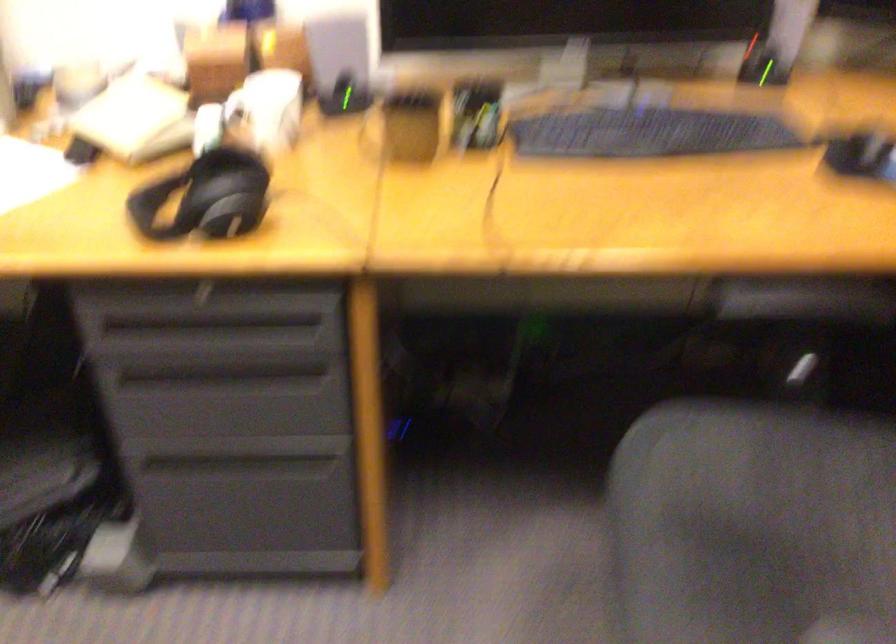
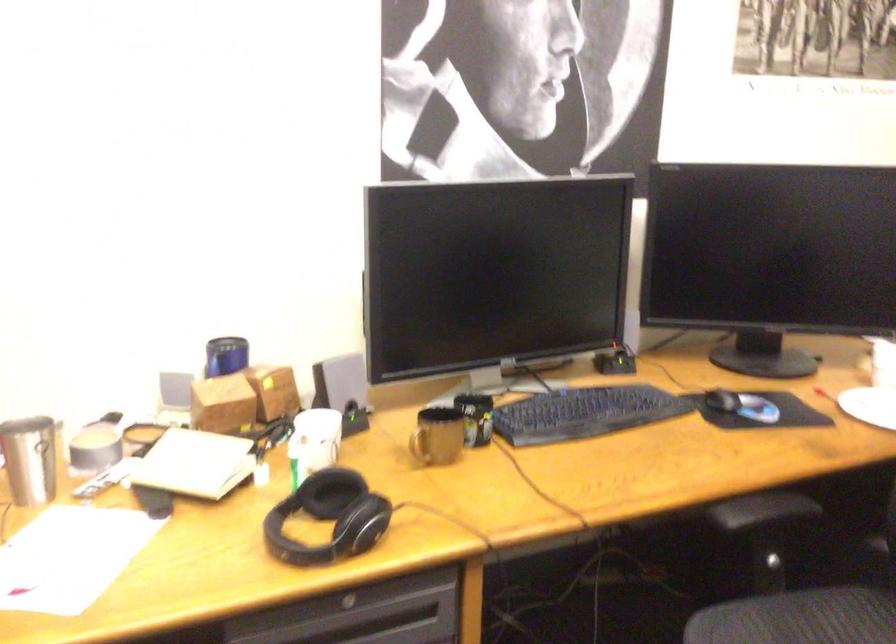
The point at (373, 138) is marked in the first image. Where is the corresponding point in the second image?

(419, 446)